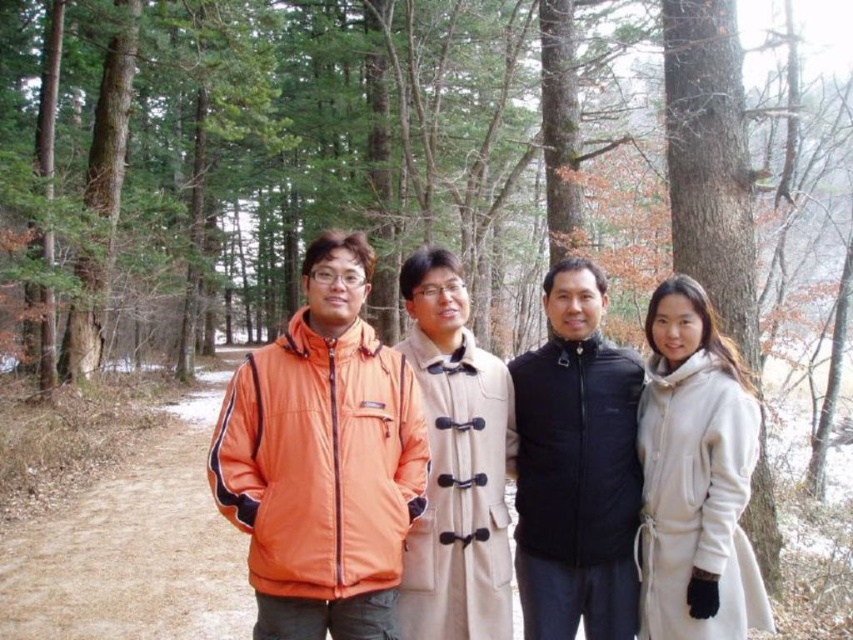
Question: Among these points, which one is farthest from the camera?

Choices:
 (A) (614, 497)
 (B) (461, 538)
 (C) (428, 285)
 (D) (676, 476)

Answer: (C)

Question: Can you confirm if orange nylon jacket at center is positioned to the right of beige wool coat at center?

Choices:
 (A) yes
 (B) no

Answer: (B)

Question: Is the position of orange nylon jacket at center more distant than that of black quilted vest at center?

Choices:
 (A) yes
 (B) no

Answer: (B)

Question: Among these objects, which one is nearest to the camera?

Choices:
 (A) orange nylon jacket at center
 (B) black quilted vest at center
 (C) beige wool coat at right

Answer: (A)

Question: Is orange nylon jacket at center to the left of beige wool coat at center from the viewer's perspective?

Choices:
 (A) no
 (B) yes

Answer: (B)

Question: Among these points, which one is nearest to the camera?

Choices:
 (A) (250, 417)
 (B) (676, 493)
 (C) (515, 528)

Answer: (A)